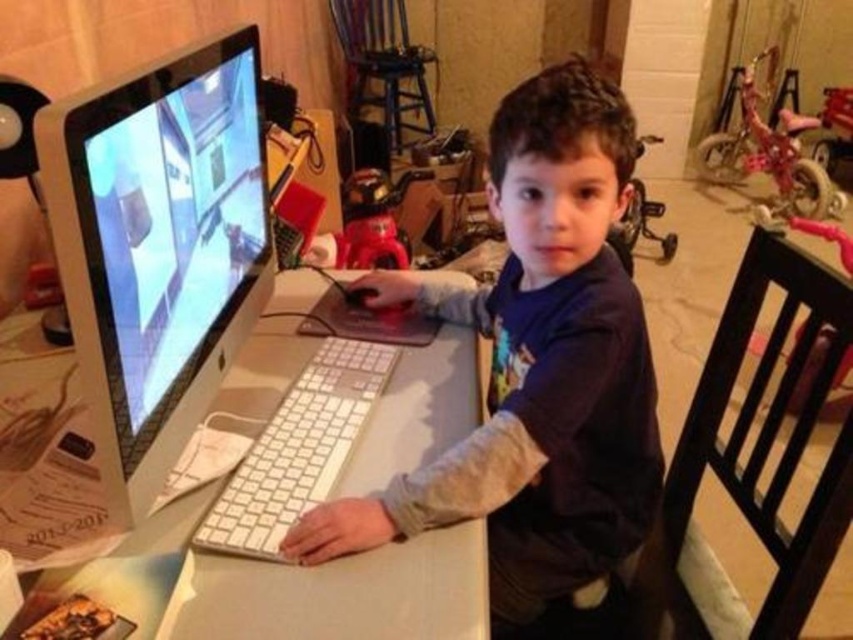
Question: Which object is closer to the camera taking this photo?

Choices:
 (A) white plastic monitor at center
 (B) matte white shirt at center

Answer: (A)

Question: Observing the image, what is the correct spatial positioning of matte white shirt at center in reference to white plastic monitor at center?

Choices:
 (A) left
 (B) right

Answer: (B)

Question: Estimate the real-world distances between objects in this image. Which object is closer to the white plastic monitor at center?

Choices:
 (A) white plastic computer desk at center
 (B) matte white shirt at center

Answer: (A)

Question: Which point is closer to the camera?

Choices:
 (A) matte white shirt at center
 (B) white plastic monitor at center
 (C) white plastic computer desk at center

Answer: (B)

Question: Can you confirm if white plastic monitor at center is smaller than white plastic computer desk at center?

Choices:
 (A) yes
 (B) no

Answer: (A)

Question: Is white plastic monitor at center wider than white plastic computer desk at center?

Choices:
 (A) no
 (B) yes

Answer: (A)